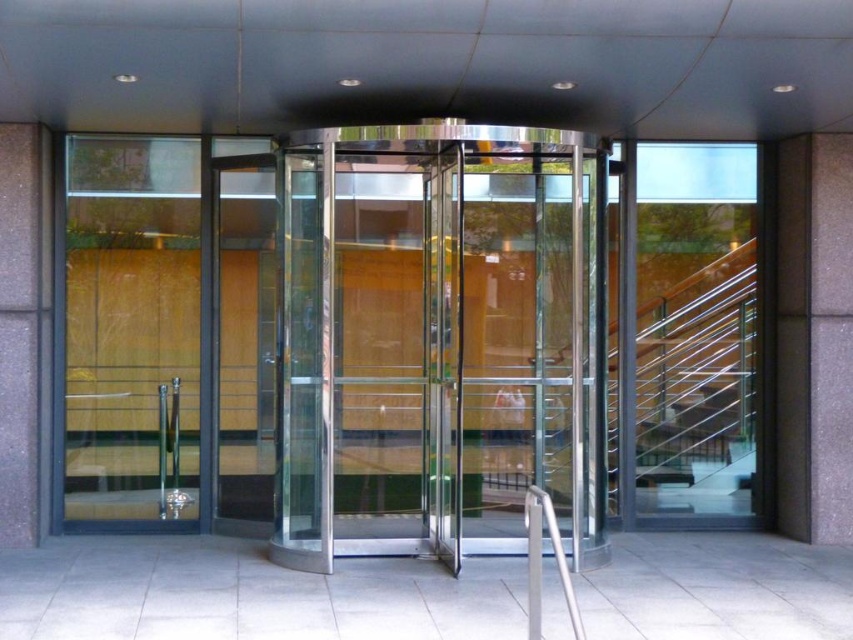
Question: Which of the following is the farthest from the observer?

Choices:
 (A) (595, 444)
 (B) (532, 604)

Answer: (A)

Question: Can you confirm if polished silver glass door at center is positioned above silver metallic handrail at center?

Choices:
 (A) yes
 (B) no

Answer: (A)

Question: Does polished silver glass door at center appear under silver metallic handrail at center?

Choices:
 (A) yes
 (B) no

Answer: (B)

Question: Considering the relative positions of polished silver glass door at center and silver metallic handrail at center in the image provided, where is polished silver glass door at center located with respect to silver metallic handrail at center?

Choices:
 (A) right
 (B) left

Answer: (B)